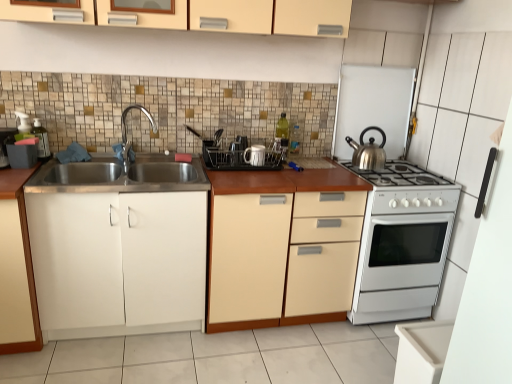
How much space does matte cream cabinet at upper center, arranged as the 1th cabinetry when viewed from the top, occupy horizontally?

matte cream cabinet at upper center, arranged as the 1th cabinetry when viewed from the top, is 12.60 inches wide.

What do you see at coordinates (402, 243) in the screenshot?
I see `white glossy oven at right` at bounding box center [402, 243].

You are a GUI agent. You are given a task and a screenshot of the screen. Output one action in this format:
    pyautogui.click(x=<x>, y=<y>)
    Task: Click on the white glossy mug at center, the 4th appliance viewed from the left
    The image size is (512, 384).
    Given the screenshot: What is the action you would take?
    pyautogui.click(x=255, y=155)

This screenshot has width=512, height=384. Describe the element at coordinates (118, 261) in the screenshot. I see `white matte cabinet at left, which is the third cabinetry in top-to-bottom order` at that location.

In order to click on white matte cabinet at left, which is the third cabinetry in top-to-bottom order in this screenshot , I will do `click(118, 261)`.

The height and width of the screenshot is (384, 512). Describe the element at coordinates (41, 139) in the screenshot. I see `translucent plastic soap dispenser at left, the 5th appliance viewed from the right` at that location.

The image size is (512, 384). Find the location of `matte cream cabinet at upper center, which is the fourth cabinetry from bottom to top`. matte cream cabinet at upper center, which is the fourth cabinetry from bottom to top is located at coordinates (312, 17).

Which is less distant, [361,162] or [380,173]?

Point [361,162] appears to be farther away from the viewer than point [380,173].

In the scene shown: Between shiny metallic kettle at right and white glossy oven at right, which one is positioned behind?

shiny metallic kettle at right.

Is shiny metallic kettle at right far away from white glossy oven at right?

shiny metallic kettle at right is actually quite close to white glossy oven at right.

How different are the orientations of white matte cabinet at left, which is the third cabinetry in top-to-bottom order, and shiny metallic kettle at right in degrees?

5.3e-05 degrees.

Is point (132, 283) in front of point (375, 164)?

Yes.

Considering the positions of objects white matte cabinet at left, which is the third cabinetry in top-to-bottom order, and shiny metallic kettle at right in the image provided, who is more to the left, white matte cabinet at left, which is the third cabinetry in top-to-bottom order, or shiny metallic kettle at right?

white matte cabinet at left, which is the third cabinetry in top-to-bottom order, is more to the left.

Starting from the matte cream cabinet at upper center, which is the fourth cabinetry from bottom to top, which appliance is the 1st one behind? Please provide its 2D coordinates.

[(41, 139)]

Consider the image. Is the position of matte cream cabinet at upper center, which is the fourth cabinetry from bottom to top, more distant than that of translucent plastic soap dispenser at left, which is the 1th appliance from left to right?

No, matte cream cabinet at upper center, which is the fourth cabinetry from bottom to top, is closer to the camera.

Which of these two, matte cream cabinet at upper center, arranged as the 1th cabinetry when viewed from the top, or translucent plastic soap dispenser at left, which is the 1th appliance from left to right, stands shorter?

Result: With less height is translucent plastic soap dispenser at left, which is the 1th appliance from left to right.

How different are the orientations of matte cream cabinet at upper center, which is the fourth cabinetry from bottom to top, and translucent plastic soap dispenser at left, the 5th appliance viewed from the right, in degrees?

matte cream cabinet at upper center, which is the fourth cabinetry from bottom to top, and translucent plastic soap dispenser at left, the 5th appliance viewed from the right, are facing 0.000375 degrees away from each other.

Identify the location of the 1st cabinetry to the left when counting from the chrome metallic faucet at left. The image size is (512, 384). (118, 261).

Is chrome metallic faucet at left smaller than white matte cabinet at left, the second cabinetry positioned from the bottom?

Yes, chrome metallic faucet at left is smaller than white matte cabinet at left, the second cabinetry positioned from the bottom.

In the scene shown: Could you tell me if chrome metallic faucet at left is facing white matte cabinet at left, which is the third cabinetry in top-to-bottom order?

No, chrome metallic faucet at left does not turn towards white matte cabinet at left, which is the third cabinetry in top-to-bottom order.

Looking at this image, considering the sizes of objects chrome metallic faucet at left and white matte cabinet at left, the second cabinetry positioned from the bottom, in the image provided, who is wider, chrome metallic faucet at left or white matte cabinet at left, the second cabinetry positioned from the bottom,?

With larger width is white matte cabinet at left, the second cabinetry positioned from the bottom.

How different are the orientations of white glossy gas stove at right and white matte cabinet at left, the 1th cabinetry from the bottom, in degrees?

The angle between the facing direction of white glossy gas stove at right and the facing direction of white matte cabinet at left, the 1th cabinetry from the bottom, is 3.47e-05 degrees.

Consider the image. Who is smaller, white glossy gas stove at right or white matte cabinet at left, marked as the fourth cabinetry in a top-to-bottom arrangement?

white glossy gas stove at right.

Between point (438, 176) and point (4, 251), which one is positioned behind?

Point (438, 176)

Is white glossy gas stove at right oriented towards white matte cabinet at left, the 1th cabinetry from the bottom?

No, white glossy gas stove at right is not turned towards white matte cabinet at left, the 1th cabinetry from the bottom.

Can you tell me how much matte cream cabinet at upper center, which is the fourth cabinetry from bottom to top, and white matte cabinet at left, which is the third cabinetry in top-to-bottom order, differ in facing direction?

The facing directions of matte cream cabinet at upper center, which is the fourth cabinetry from bottom to top, and white matte cabinet at left, which is the third cabinetry in top-to-bottom order, are 2.87e-05 degrees apart.

From the image's perspective, is matte cream cabinet at upper center, which is the fourth cabinetry from bottom to top, on top of white matte cabinet at left, the second cabinetry positioned from the bottom?

Yes.

Would you say matte cream cabinet at upper center, which is the fourth cabinetry from bottom to top, is outside white matte cabinet at left, which is the third cabinetry in top-to-bottom order?

Yes, matte cream cabinet at upper center, which is the fourth cabinetry from bottom to top, is not within white matte cabinet at left, which is the third cabinetry in top-to-bottom order.

Considering the points (87, 15) and (132, 201), which point is behind, point (87, 15) or point (132, 201)?

Positioned behind is point (132, 201).

Which is more to the right, beige matte cabinet at center, arranged as the third cabinetry when ordered from the bottom, or chrome metallic faucet at left?

beige matte cabinet at center, arranged as the third cabinetry when ordered from the bottom, is more to the right.

Is beige matte cabinet at center, arranged as the third cabinetry when ordered from the bottom, looking in the opposite direction of chrome metallic faucet at left?

That's not correct — beige matte cabinet at center, arranged as the third cabinetry when ordered from the bottom, is not looking away from chrome metallic faucet at left.

Where is `cabinetry that is the 1st object located in front of the chrome metallic faucet at left`? The height and width of the screenshot is (384, 512). cabinetry that is the 1st object located in front of the chrome metallic faucet at left is located at coordinates (281, 256).

Image resolution: width=512 pixels, height=384 pixels. I want to click on kitchen appliance above the white glossy oven at right (from the image's perspective), so click(368, 151).

Find the location of `the 3rd cabinetry to the left of the shiny metallic kettle at right, counting from the anchor's position`. the 3rd cabinetry to the left of the shiny metallic kettle at right, counting from the anchor's position is located at coordinates (118, 261).

Based on their spatial positions, is white glossy mug at center, placed as the second appliance when sorted from right to left, or white glossy oven at right closer to white matte cabinet at left, the 1th cabinetry from the bottom?

Based on the image, white glossy mug at center, placed as the second appliance when sorted from right to left, appears to be nearer to white matte cabinet at left, the 1th cabinetry from the bottom.

Which object lies nearer to the anchor point black plastic dish rack at center, acting as the third appliance starting from the right, white matte cabinet at left, the 1th cabinetry from the bottom, or shiny metallic kettle at right?

Among the two, shiny metallic kettle at right is located nearer to black plastic dish rack at center, acting as the third appliance starting from the right.

From the image, which object appears to be farther from white glossy oven at right, black plastic dish rack at center, the third appliance in the left-to-right sequence, or white matte cabinet at left, marked as the fourth cabinetry in a top-to-bottom arrangement?

Based on the image, white matte cabinet at left, marked as the fourth cabinetry in a top-to-bottom arrangement, appears to be further to white glossy oven at right.

Looking at the image, which one is located further to white matte cabinet at left, the second cabinetry positioned from the bottom, white glossy oven at right or white matte cabinet at left, the 1th cabinetry from the bottom?

white glossy oven at right lies further to white matte cabinet at left, the second cabinetry positioned from the bottom, than the other object.

Considering their positions, is white glossy oven at right positioned closer to white matte cabinet at left, the 1th cabinetry from the bottom, than clear plastic utensil rack at center, the fourth appliance when ordered from right to left?

Based on the image, clear plastic utensil rack at center, the fourth appliance when ordered from right to left, appears to be nearer to white matte cabinet at left, the 1th cabinetry from the bottom.

Based on their spatial positions, is white glossy oven at right or white glossy mug at center, placed as the second appliance when sorted from right to left, closer to clear plastic utensil rack at center, which ranks as the 2th appliance in left-to-right order?

Among the two, white glossy mug at center, placed as the second appliance when sorted from right to left, is located nearer to clear plastic utensil rack at center, which ranks as the 2th appliance in left-to-right order.

Estimate the real-world distances between objects in this image. Which object is further from white glossy oven at right, white matte cabinet at left, marked as the fourth cabinetry in a top-to-bottom arrangement, or beige matte cabinet at center, arranged as the third cabinetry when ordered from the bottom?

white matte cabinet at left, marked as the fourth cabinetry in a top-to-bottom arrangement, lies further to white glossy oven at right than the other object.

Considering their positions, is silver metallic kettle at upper right, which is counted as the 5th appliance, starting from the left, positioned closer to white glossy gas stove at right than beige matte cabinet at center, arranged as the third cabinetry when ordered from the bottom?

silver metallic kettle at upper right, which is counted as the 5th appliance, starting from the left, lies closer to white glossy gas stove at right than the other object.

The image size is (512, 384). Find the location of `appliance situated between white glossy mug at center, placed as the second appliance when sorted from right to left, and white glossy gas stove at right from left to right`. appliance situated between white glossy mug at center, placed as the second appliance when sorted from right to left, and white glossy gas stove at right from left to right is located at coordinates (373, 106).

Identify the location of kitchen appliance between white glossy mug at center, the 4th appliance viewed from the left, and white glossy oven at right from left to right. Image resolution: width=512 pixels, height=384 pixels. (368, 151).

Locate an element on the screen. The image size is (512, 384). kitchen appliance between chrome metallic faucet at left and white glossy gas stove at right in the horizontal direction is located at coordinates (368, 151).

Where is `kitchen appliance between matte cream cabinet at upper center, arranged as the 1th cabinetry when viewed from the top, and silver metallic kettle at upper right, which is the first appliance from right to left, in the horizontal direction`? kitchen appliance between matte cream cabinet at upper center, arranged as the 1th cabinetry when viewed from the top, and silver metallic kettle at upper right, which is the first appliance from right to left, in the horizontal direction is located at coordinates (368, 151).